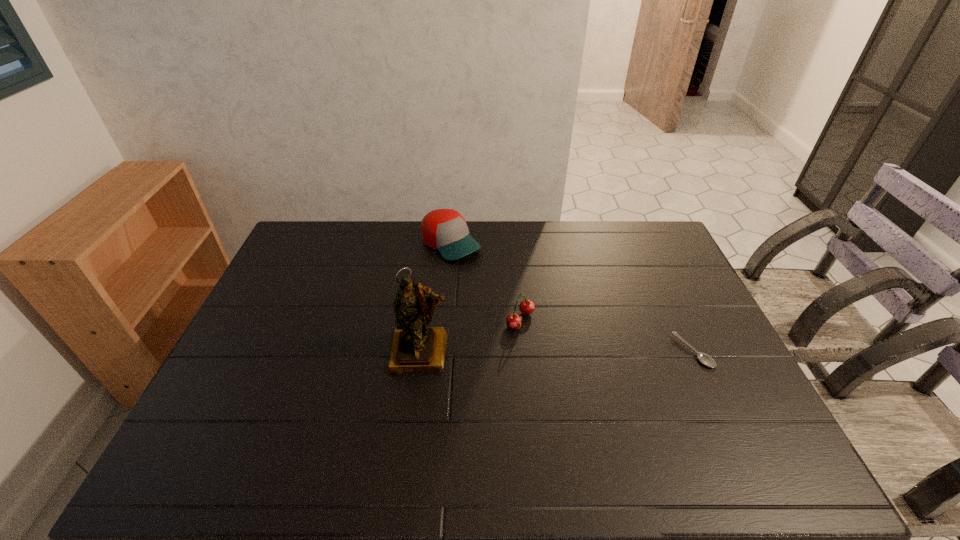
I want to click on free space between the tallest object and the third object from left to right, so click(470, 336).

Where is `empty space between the cherry and the baseball cap`? This screenshot has width=960, height=540. empty space between the cherry and the baseball cap is located at coordinates (486, 282).

I want to click on free space that is in between the second object from right to left and the soupspoon, so click(x=607, y=336).

Image resolution: width=960 pixels, height=540 pixels. In order to click on empty space between the cherry and the rightmost object in this screenshot , I will do [607, 336].

Image resolution: width=960 pixels, height=540 pixels. Identify the location of free point between the tallest object and the soupspoon. (557, 352).

Locate an element on the screen. Image resolution: width=960 pixels, height=540 pixels. unoccupied area between the tallest object and the soupspoon is located at coordinates (557, 352).

What are the coordinates of `empty space between the rightmost object and the figurine` in the screenshot? It's located at (557, 352).

At what (x,y) coordinates should I click in order to perform the action: click on vacant area between the shortest object and the farthest object. Please return your answer as a coordinate pair (x, y). The width and height of the screenshot is (960, 540). Looking at the image, I should click on pos(572,298).

Identify the location of free point between the cherry and the tallest object. (470, 336).

Where is `object that can be found as the second closest to the cherry`? The width and height of the screenshot is (960, 540). object that can be found as the second closest to the cherry is located at coordinates (445, 230).